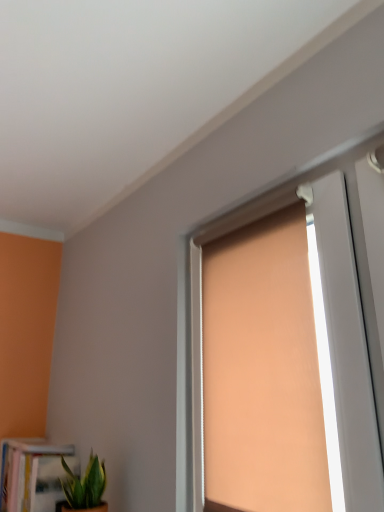
Question: Considering their positions, is white glossy bookcase at lower left located in front of or behind green leafy plant at lower left?

Choices:
 (A) behind
 (B) front

Answer: (A)

Question: In terms of width, does white glossy bookcase at lower left look wider or thinner when compared to green leafy plant at lower left?

Choices:
 (A) wide
 (B) thin

Answer: (A)

Question: Which object is the farthest from the matte orange roller blind at center?

Choices:
 (A) green leafy plant at lower left
 (B) white glossy bookcase at lower left

Answer: (B)

Question: Estimate the real-world distances between objects in this image. Which object is closer to the green leafy plant at lower left?

Choices:
 (A) white glossy bookcase at lower left
 (B) matte orange roller blind at center

Answer: (A)